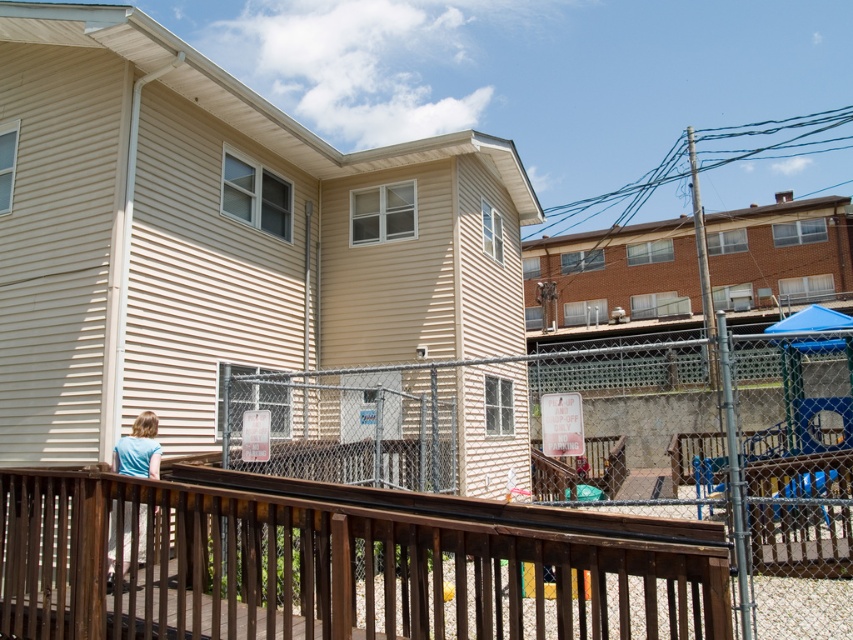
In the scene shown: Between brown wooden railing at lower center and light blue shirt at lower left, which one is positioned higher?

brown wooden railing at lower center is above.

From the picture: Is brown wooden railing at lower center below light blue shirt at lower left?

No.

Between point (606, 561) and point (132, 468), which one is positioned behind?

The point (132, 468) is more distant.

Identify the location of brown wooden railing at lower center. Image resolution: width=853 pixels, height=640 pixels. (323, 568).

Locate an element on the screen. The width and height of the screenshot is (853, 640). brown wooden fence at lower center is located at coordinates (448, 524).

Between point (608, 588) and point (157, 460), which one is positioned behind?

Positioned behind is point (608, 588).

Between point (312, 413) and point (149, 413), which one is positioned in front?

Point (149, 413) is more forward.

Find the location of a particular element. brown wooden fence at lower center is located at coordinates (448, 524).